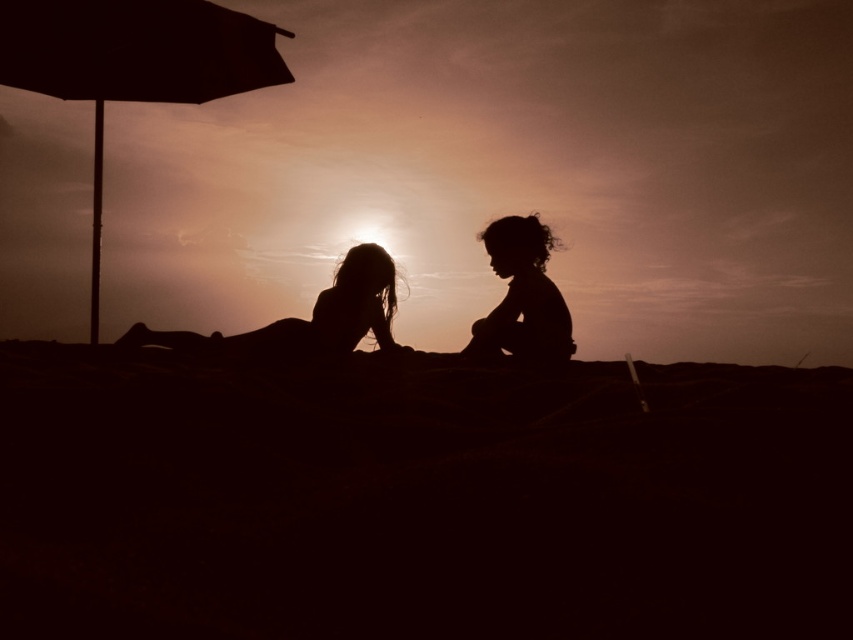
You are a photographer trying to capture a closeup shot of both the silhouette figure at center and the silhouette child at center. Given that your camera has a maximum focus range of 38 inches, will you be able to capture both subjects in focus?

The silhouette figure at center and the silhouette child at center are 39.33 inches apart from each other. Since the distance between them exceeds the camera maximum focus range of 38 inches, you will not be able to capture both subjects in focus.